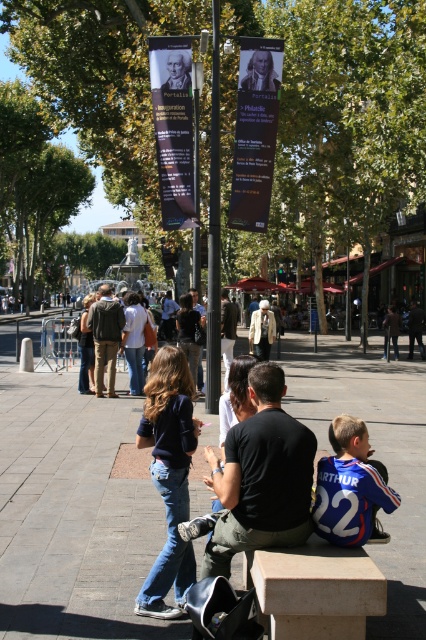
Question: Considering the relative positions of gray concrete pavement at center and black matte shirt at center in the image provided, where is gray concrete pavement at center located with respect to black matte shirt at center?

Choices:
 (A) left
 (B) right

Answer: (A)

Question: Estimate the real-world distances between objects in this image. Which object is farther from the gray concrete pavement at center?

Choices:
 (A) beige stone bench at center
 (B) light brown leather jacket at center
 (C) dark brown leather jacket at center

Answer: (C)

Question: Does beige stone bench at center appear on the left side of light brown leather jacket at center?

Choices:
 (A) no
 (B) yes

Answer: (A)

Question: Considering the relative positions of gray concrete pavement at center and beige stone bench at center in the image provided, where is gray concrete pavement at center located with respect to beige stone bench at center?

Choices:
 (A) below
 (B) above

Answer: (B)

Question: Which of the following is the farthest from the observer?

Choices:
 (A) gray concrete pavement at center
 (B) light brown leather jacket at center

Answer: (B)

Question: Which of the following is the closest to the observer?

Choices:
 (A) (233, 305)
 (B) (345, 596)

Answer: (B)